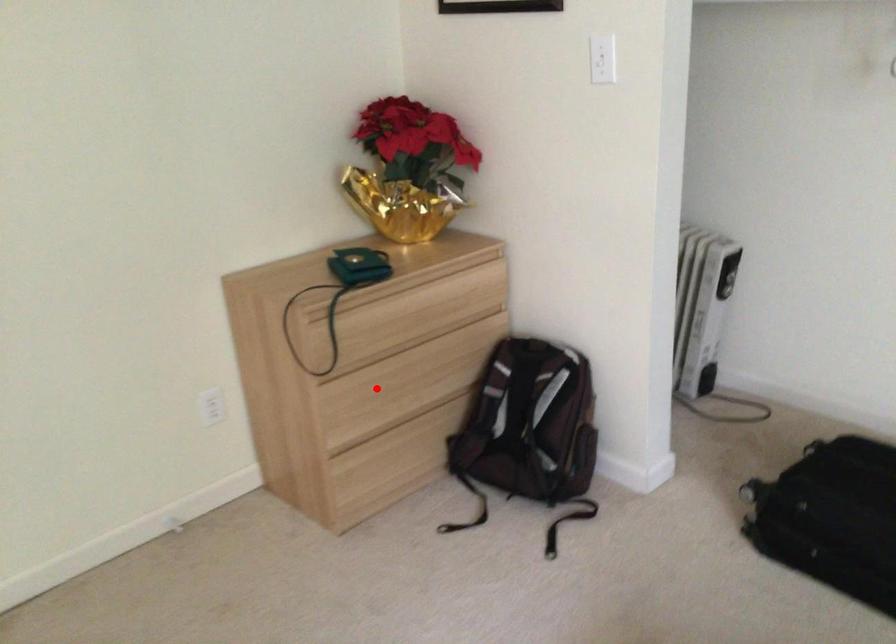
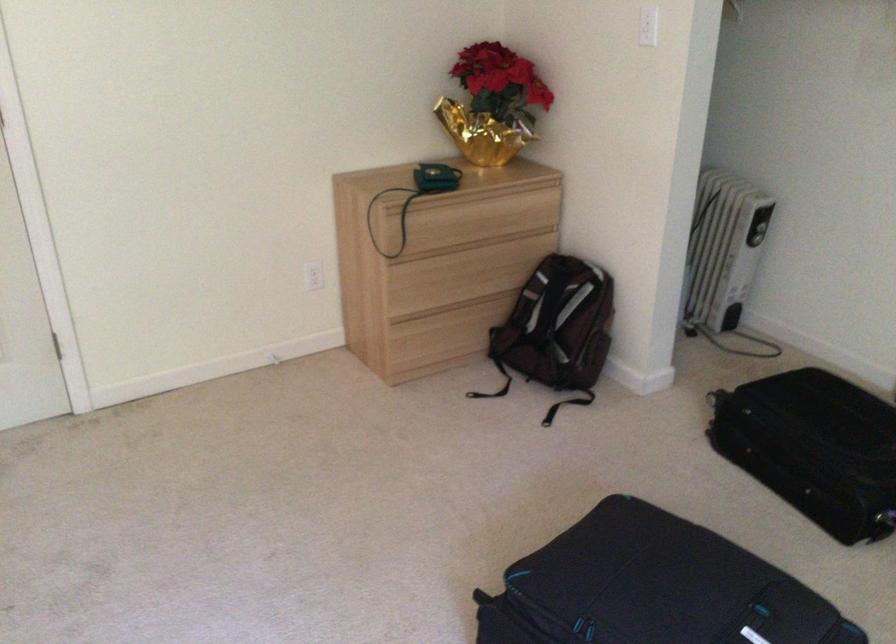
Question: I am providing you with two images of the same scene from different viewpoints. In image1, a red point is highlighted. Considering the same 3D point in image2, which of the following is correct?

Choices:
 (A) It is closer
 (B) It is farther

Answer: (B)